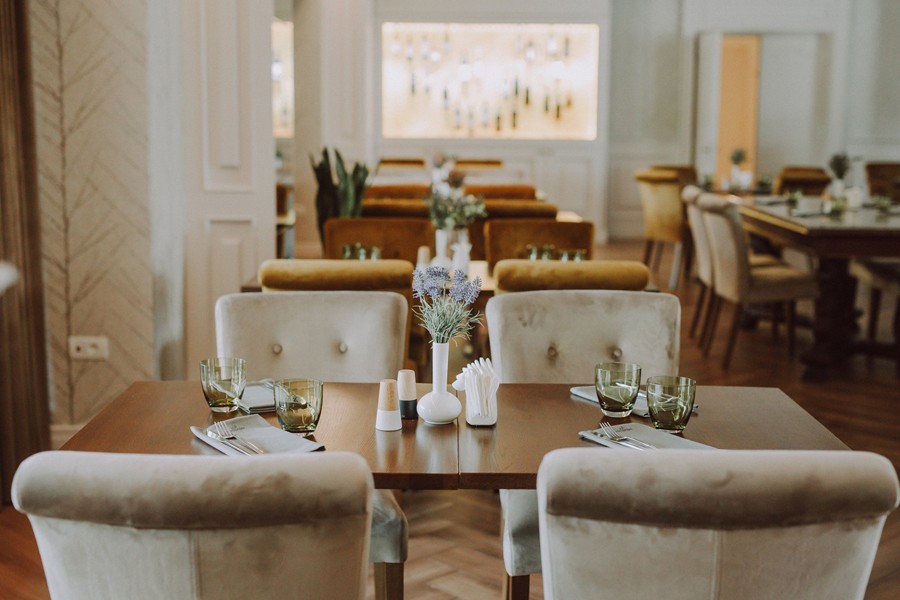
At what (x,y) coordinates should I click in order to perform the action: click on flowers on tables. Please return your answer as a coordinate pair (x, y). Looking at the image, I should click on (442, 328), (451, 220), (438, 156), (838, 166), (742, 157).